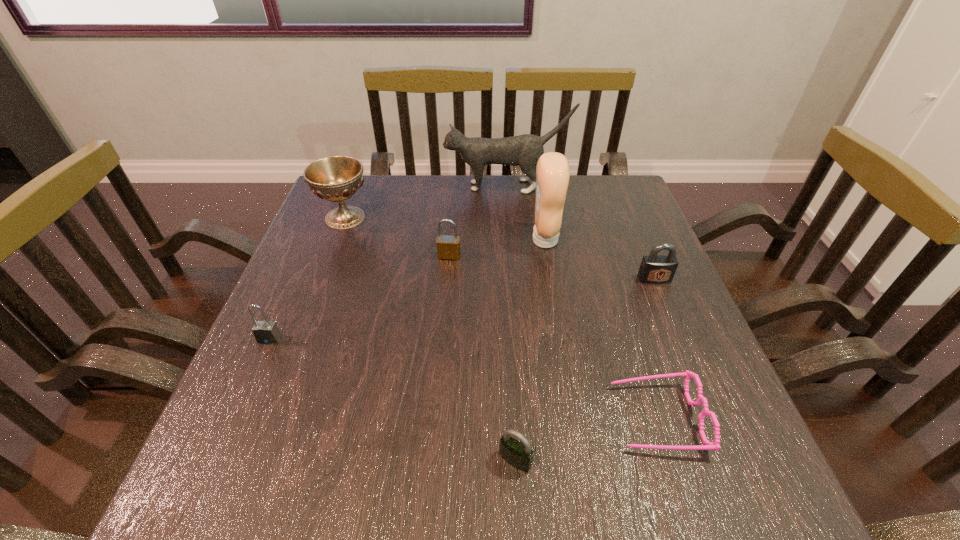
The image size is (960, 540). I want to click on free spot between the second padlock from left to right and the farthest object, so pyautogui.click(x=478, y=221).

Choose which object is the fifth nearest neighbor to the farthest padlock. Please provide its 2D coordinates. Your answer should be formatted as a tuple, i.e. [(x, y)], where the tuple contains the x and y coordinates of a point satisfying the conditions above.

[(656, 269)]

Locate which object ranks seventh in proximity to the second padlock from right to left. Please provide its 2D coordinates. Your answer should be formatted as a tuple, i.e. [(x, y)], where the tuple contains the x and y coordinates of a point satisfying the conditions above.

[(524, 150)]

Locate an element on the screen. The image size is (960, 540). the second closest padlock to the condiment is located at coordinates (656, 269).

Select which padlock appears as the second closest to the second nearest padlock. Please provide its 2D coordinates. Your answer should be formatted as a tuple, i.e. [(x, y)], where the tuple contains the x and y coordinates of a point satisfying the conditions above.

[(519, 455)]

In order to click on blank space that satisfies the following two spatial constraints: 1. at the face of the farthest object; 2. on the shackle of the second nearest padlock in this screenshot , I will do `click(518, 339)`.